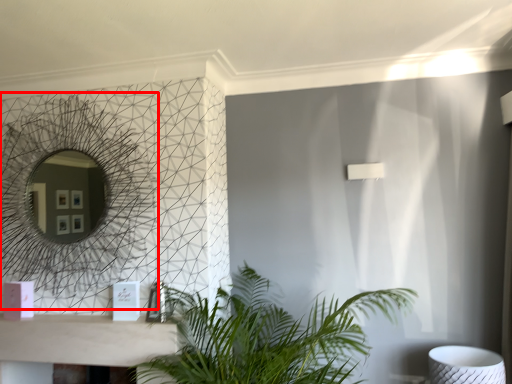
Question: Considering the relative positions of mirror (annotated by the red box) and houseplant in the image provided, where is mirror (annotated by the red box) located with respect to the staircase?

Choices:
 (A) right
 (B) left

Answer: (B)